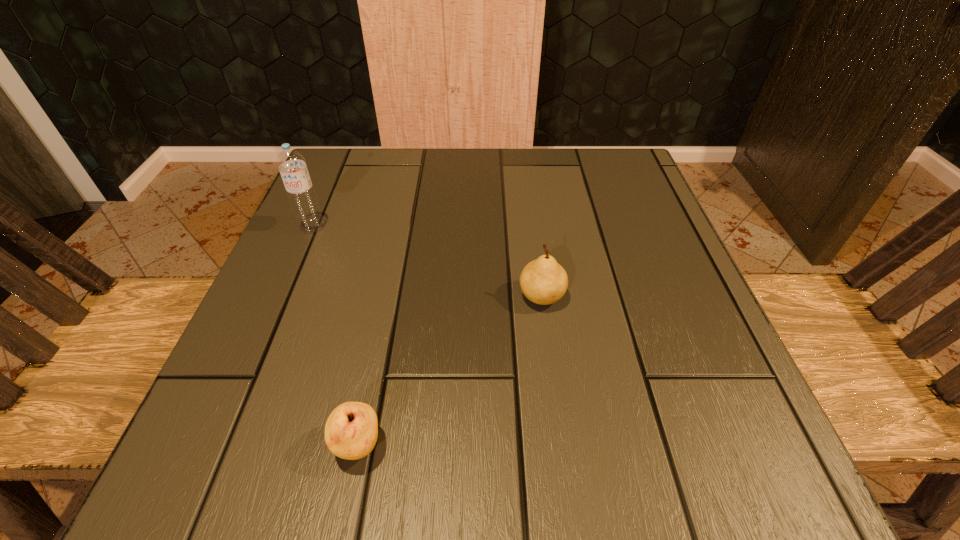
Where is `object that is at the left edge`? The image size is (960, 540). object that is at the left edge is located at coordinates (292, 165).

You are a GUI agent. You are given a task and a screenshot of the screen. Output one action in this format:
    pyautogui.click(x=<x>, y=<y>)
    Task: Click on the blank space at the far edge of the desktop
    The width and height of the screenshot is (960, 540).
    Given the screenshot: What is the action you would take?
    (x=425, y=175)

The image size is (960, 540). I want to click on free region at the near edge, so click(585, 473).

The height and width of the screenshot is (540, 960). I want to click on vacant space at the left edge, so click(x=316, y=247).

This screenshot has width=960, height=540. What are the coordinates of `vacant space at the right edge of the desktop` in the screenshot? It's located at (694, 335).

Where is `vacant space at the far left corner of the desktop`? vacant space at the far left corner of the desktop is located at coordinates (338, 167).

The width and height of the screenshot is (960, 540). Identify the location of free space at the near left corner of the desktop. (253, 454).

Locate an element on the screen. This screenshot has width=960, height=540. free space at the far right corner of the desktop is located at coordinates (630, 162).

You are a GUI agent. You are given a task and a screenshot of the screen. Output one action in this format:
    pyautogui.click(x=<x>, y=<y>)
    Task: Click on the vacant region at the near right corner
    
    Given the screenshot: What is the action you would take?
    pyautogui.click(x=655, y=456)

At what (x,y) coordinates should I click in order to perform the action: click on empty space between the nearer pear and the farthest object. Please return your answer as a coordinate pair (x, y). The width and height of the screenshot is (960, 540). Looking at the image, I should click on (335, 336).